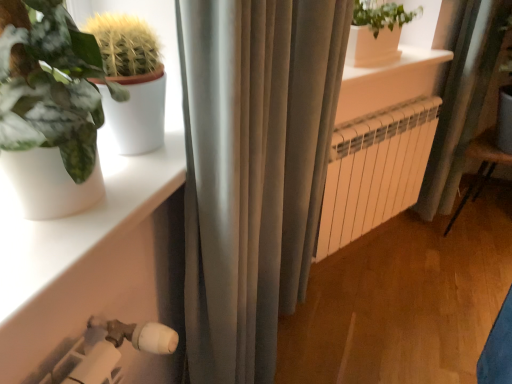
Question: Is the position of white smooth window sill at upper center more distant than that of white metallic radiator at center?

Choices:
 (A) no
 (B) yes

Answer: (A)

Question: Considering the relative positions of white smooth window sill at upper center and white metallic radiator at center in the image provided, is white smooth window sill at upper center to the left of white metallic radiator at center from the viewer's perspective?

Choices:
 (A) no
 (B) yes

Answer: (B)

Question: Are white smooth window sill at upper center and white metallic radiator at center located far from each other?

Choices:
 (A) no
 (B) yes

Answer: (A)

Question: Is white smooth window sill at upper center wider than white metallic radiator at center?

Choices:
 (A) no
 (B) yes

Answer: (B)

Question: Is white metallic radiator at center a part of white smooth window sill at upper center?

Choices:
 (A) no
 (B) yes

Answer: (A)

Question: Considering the relative positions of white smooth window sill at upper center and white matte shelf at lower left in the image provided, is white smooth window sill at upper center to the left or to the right of white matte shelf at lower left?

Choices:
 (A) left
 (B) right

Answer: (B)

Question: Does point (416, 56) appear closer or farther from the camera than point (134, 370)?

Choices:
 (A) closer
 (B) farther

Answer: (B)

Question: From the image's perspective, relative to white matte shelf at lower left, is white smooth window sill at upper center above or below?

Choices:
 (A) below
 (B) above

Answer: (B)

Question: From a real-world perspective, is white smooth window sill at upper center positioned above or below white matte shelf at lower left?

Choices:
 (A) below
 (B) above

Answer: (B)

Question: From the image's perspective, is white matte shelf at lower left positioned above or below white metallic radiator at center?

Choices:
 (A) below
 (B) above

Answer: (A)

Question: Is white matte shelf at lower left taller or shorter than white metallic radiator at center?

Choices:
 (A) tall
 (B) short

Answer: (B)

Question: Is white matte shelf at lower left in front of or behind white metallic radiator at center in the image?

Choices:
 (A) behind
 (B) front

Answer: (B)

Question: Is white matte shelf at lower left wider or thinner than white metallic radiator at center?

Choices:
 (A) wide
 (B) thin

Answer: (A)

Question: In terms of size, does white smooth window sill at upper center appear bigger or smaller than wooden armchair at lower right?

Choices:
 (A) small
 (B) big

Answer: (A)

Question: Is white smooth window sill at upper center situated inside wooden armchair at lower right or outside?

Choices:
 (A) inside
 (B) outside

Answer: (B)